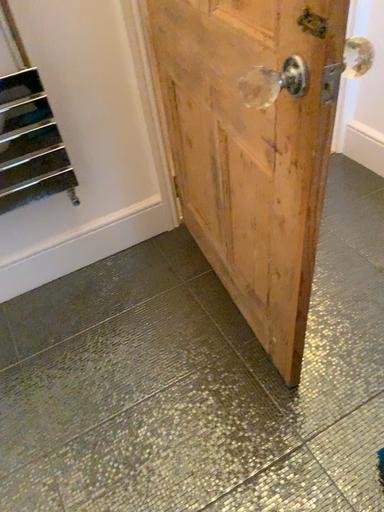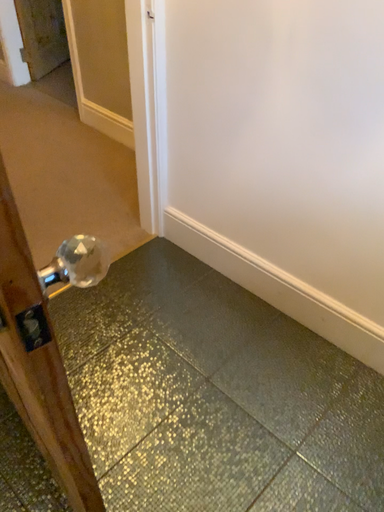
Question: How did the camera likely rotate when shooting the video?

Choices:
 (A) rotated right
 (B) rotated left

Answer: (A)